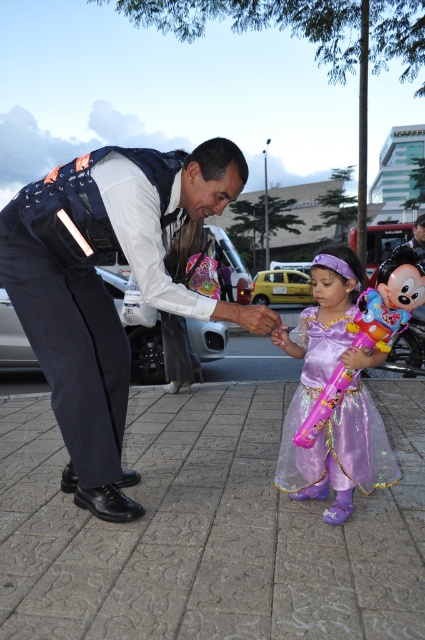
Question: Which of the following is the closest to the observer?

Choices:
 (A) dark blue uniform at left
 (B) shiny plastic balloon at center
 (C) purple iridescent dress at center

Answer: (A)

Question: Among these points, which one is nearest to the camera?

Choices:
 (A) (311, 404)
 (B) (249, 308)

Answer: (B)

Question: Does purple iridescent dress at center have a lesser width compared to shiny plastic balloon at center?

Choices:
 (A) no
 (B) yes

Answer: (B)

Question: Estimate the real-world distances between objects in this image. Which object is closer to the purple iridescent dress at center?

Choices:
 (A) shiny plastic balloon at center
 (B) dark blue uniform at left

Answer: (A)

Question: Is dark blue uniform at left wider than purple iridescent dress at center?

Choices:
 (A) no
 (B) yes

Answer: (B)

Question: From the image, what is the correct spatial relationship of dark blue uniform at left in relation to purple iridescent dress at center?

Choices:
 (A) left
 (B) right

Answer: (A)